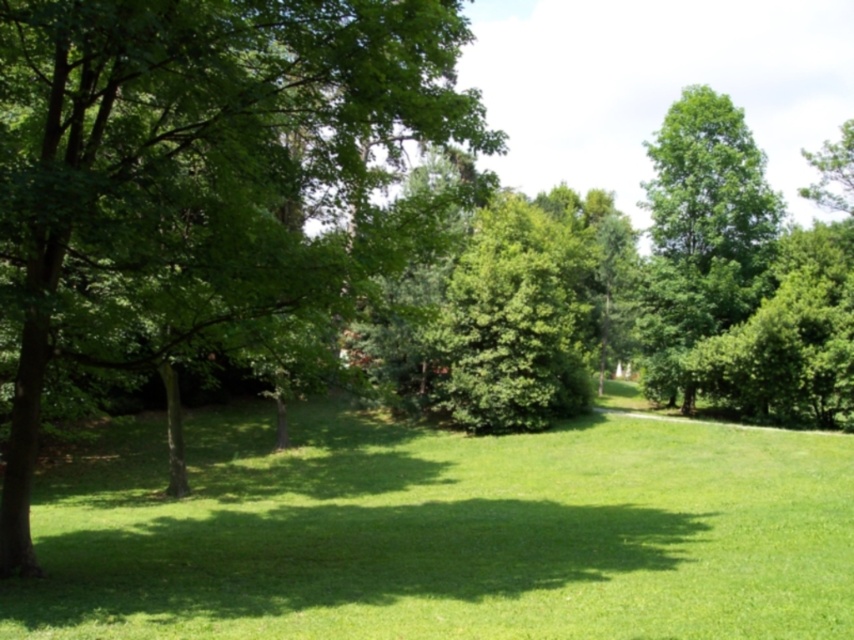
Question: Is the position of green grass at center more distant than that of green leafy tree at left?

Choices:
 (A) yes
 (B) no

Answer: (B)

Question: Does green leafy tree at left have a smaller size compared to green leafy tree at upper right?

Choices:
 (A) no
 (B) yes

Answer: (B)

Question: Estimate the real-world distances between objects in this image. Which object is farther from the green leafy tree at left?

Choices:
 (A) green grass at center
 (B) green leafy tree at upper right

Answer: (B)

Question: Which point is farther to the camera?

Choices:
 (A) green grass at center
 (B) green leafy tree at upper right
 (C) green leafy tree at left

Answer: (B)

Question: Which of the following is the closest to the observer?

Choices:
 (A) green leafy tree at upper right
 (B) green leafy tree at left
 (C) green grass at center

Answer: (C)

Question: Is green grass at center below green leafy tree at upper right?

Choices:
 (A) no
 (B) yes

Answer: (B)